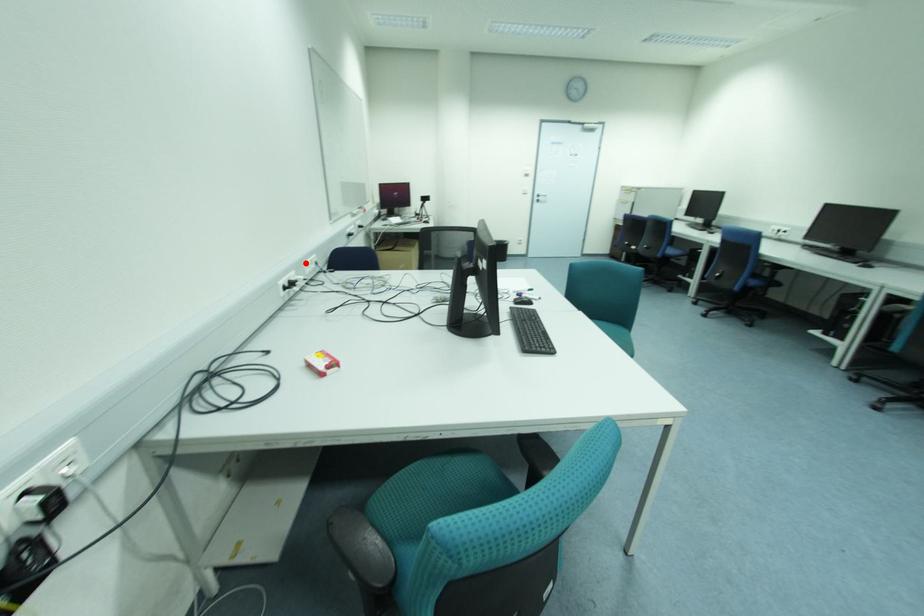
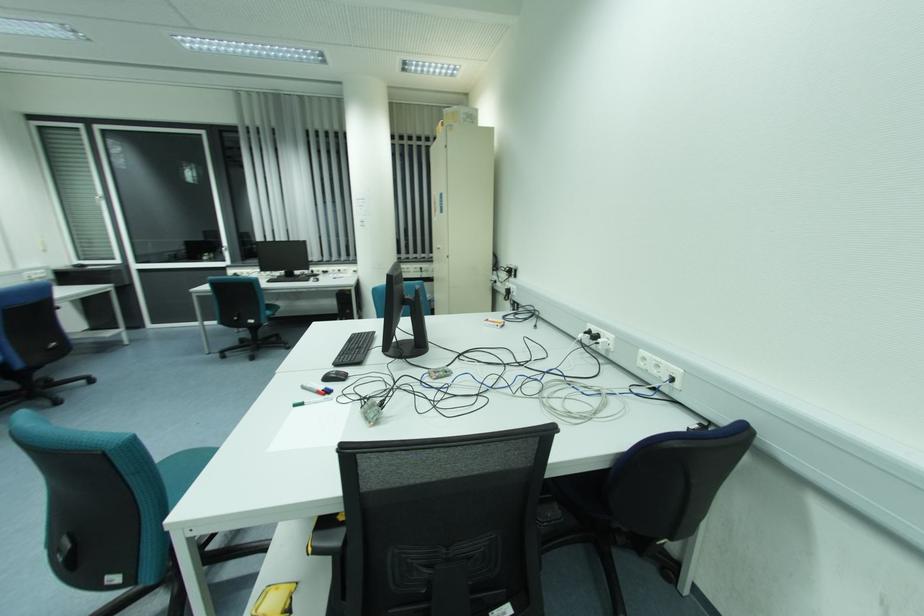
Where in the second image is the point corresponding to the highlighted location from the first image?

(642, 352)